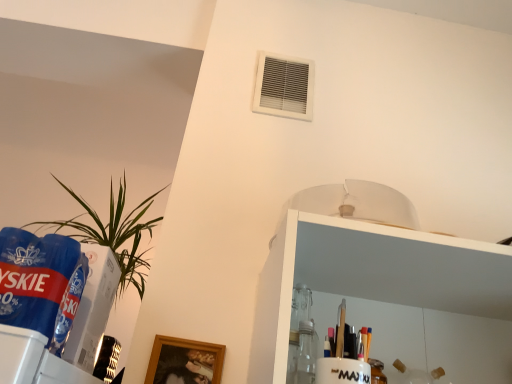
Question: Considering the relative positions of green leafy plant at left and white plastic air conditioning at upper center in the image provided, is green leafy plant at left to the right of white plastic air conditioning at upper center from the viewer's perspective?

Choices:
 (A) no
 (B) yes

Answer: (A)

Question: From the image's perspective, is green leafy plant at left on white plastic air conditioning at upper center?

Choices:
 (A) no
 (B) yes

Answer: (A)

Question: Does green leafy plant at left turn towards white plastic air conditioning at upper center?

Choices:
 (A) yes
 (B) no

Answer: (B)

Question: Is green leafy plant at left closer to the viewer compared to white plastic air conditioning at upper center?

Choices:
 (A) no
 (B) yes

Answer: (B)

Question: From a real-world perspective, is green leafy plant at left below white plastic air conditioning at upper center?

Choices:
 (A) no
 (B) yes

Answer: (B)

Question: Are green leafy plant at left and white plastic air conditioning at upper center beside each other?

Choices:
 (A) yes
 (B) no

Answer: (B)

Question: Is white plastic air conditioning at upper center far from green leafy plant at left?

Choices:
 (A) no
 (B) yes

Answer: (A)

Question: Does white plastic air conditioning at upper center have a greater height compared to green leafy plant at left?

Choices:
 (A) no
 (B) yes

Answer: (A)

Question: Is white plastic air conditioning at upper center to the left of green leafy plant at left from the viewer's perspective?

Choices:
 (A) yes
 (B) no

Answer: (B)

Question: Considering the relative sizes of white plastic air conditioning at upper center and green leafy plant at left in the image provided, is white plastic air conditioning at upper center shorter than green leafy plant at left?

Choices:
 (A) yes
 (B) no

Answer: (A)

Question: Is white plastic air conditioning at upper center positioned before green leafy plant at left?

Choices:
 (A) yes
 (B) no

Answer: (B)

Question: Could you tell me if white plastic air conditioning at upper center is turned towards green leafy plant at left?

Choices:
 (A) yes
 (B) no

Answer: (B)

Question: Is white plastic air conditioning at upper center beside blue plastic beverage at left?

Choices:
 (A) yes
 (B) no

Answer: (B)